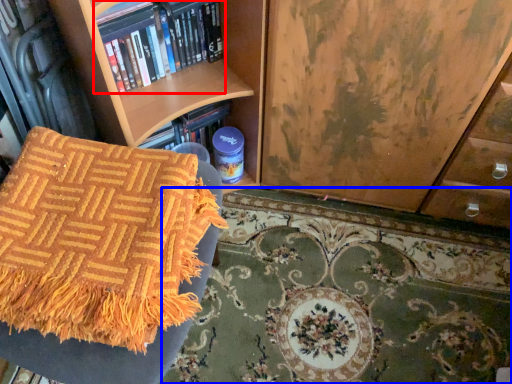
Question: Which object appears closest to the camera in this image, book (highlighted by a red box) or mat (highlighted by a blue box)?

Choices:
 (A) book
 (B) mat

Answer: (A)